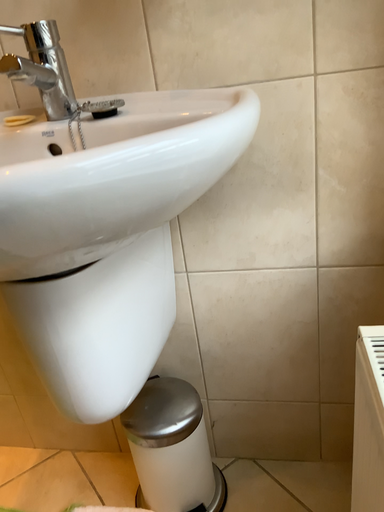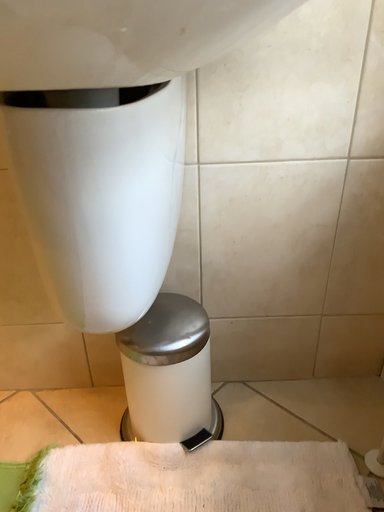
Question: Which way did the camera rotate in the video?

Choices:
 (A) rotated right
 (B) rotated left

Answer: (A)